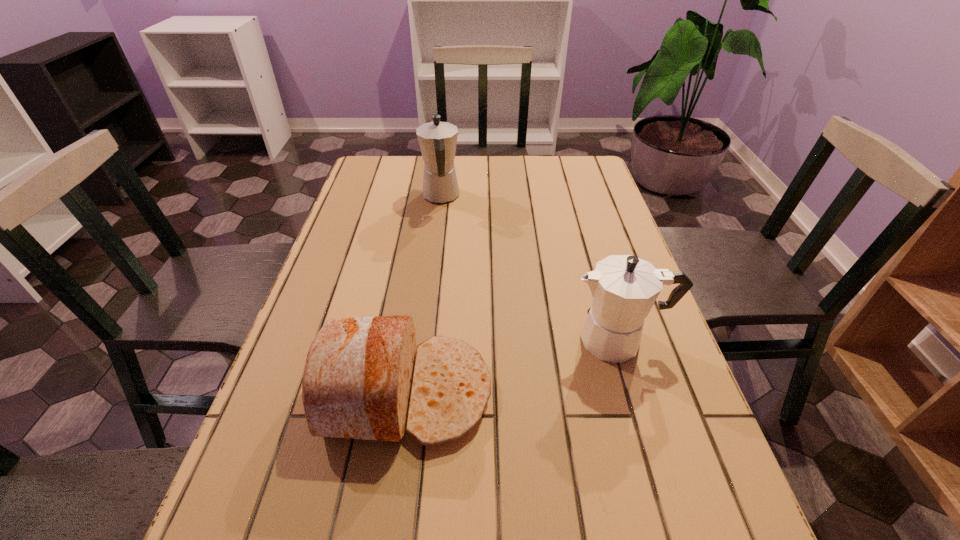
Locate an element on the screen. object located in the far edge section of the desktop is located at coordinates (437, 140).

At what (x,y) coordinates should I click in order to perform the action: click on object at the left edge. Please return your answer as a coordinate pair (x, y). Image resolution: width=960 pixels, height=540 pixels. Looking at the image, I should click on (357, 379).

This screenshot has width=960, height=540. Identify the location of object that is at the right edge. (624, 288).

You are a GUI agent. You are given a task and a screenshot of the screen. Output one action in this format:
    pyautogui.click(x=<x>, y=<y>)
    Task: Click on the vacant space at the far edge
    The image size is (960, 540).
    Given the screenshot: What is the action you would take?
    pyautogui.click(x=513, y=174)

This screenshot has width=960, height=540. What are the coordinates of `free spot at the left edge of the desktop` in the screenshot? It's located at (271, 530).

Locate an element on the screen. The width and height of the screenshot is (960, 540). vacant space at the right edge is located at coordinates (661, 471).

Where is `vacant region at the far left corner of the desktop`? This screenshot has width=960, height=540. vacant region at the far left corner of the desktop is located at coordinates (402, 179).

In the image, there is a desktop. Where is `vacant space at the far right corner`? This screenshot has width=960, height=540. vacant space at the far right corner is located at coordinates (572, 157).

Identify the location of vacant space that is in between the left coffeepot and the right coffeepot. The height and width of the screenshot is (540, 960). (530, 268).

This screenshot has width=960, height=540. Find the location of `free spot between the left coffeepot and the nearer coffeepot`. free spot between the left coffeepot and the nearer coffeepot is located at coordinates (530, 268).